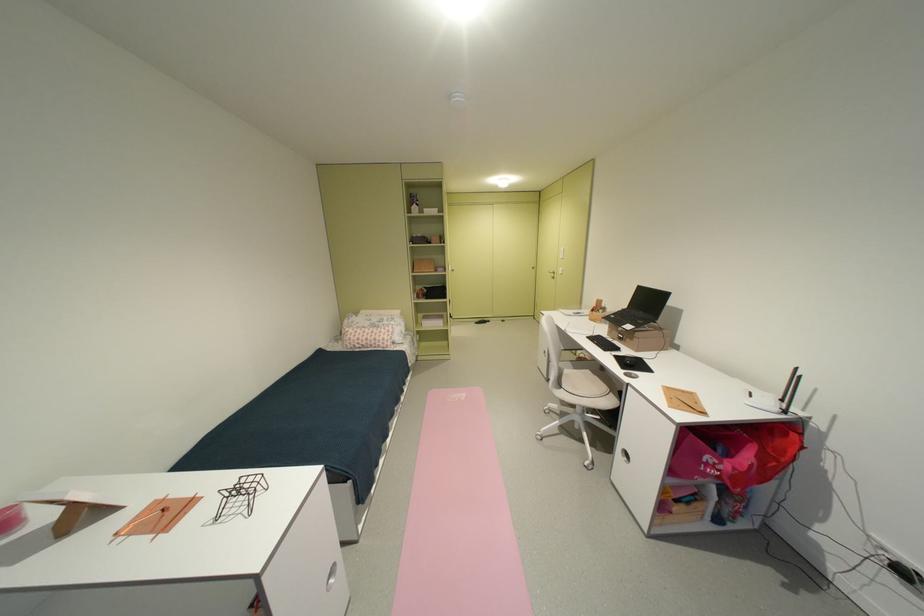
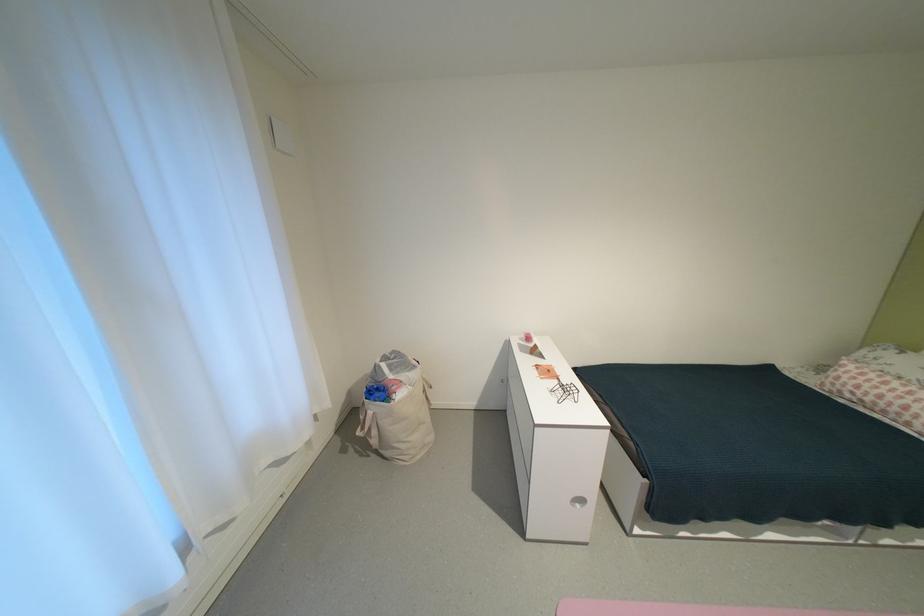
Find the pixel in the second image that matches (x=369, y=342) in the first image.

(867, 392)